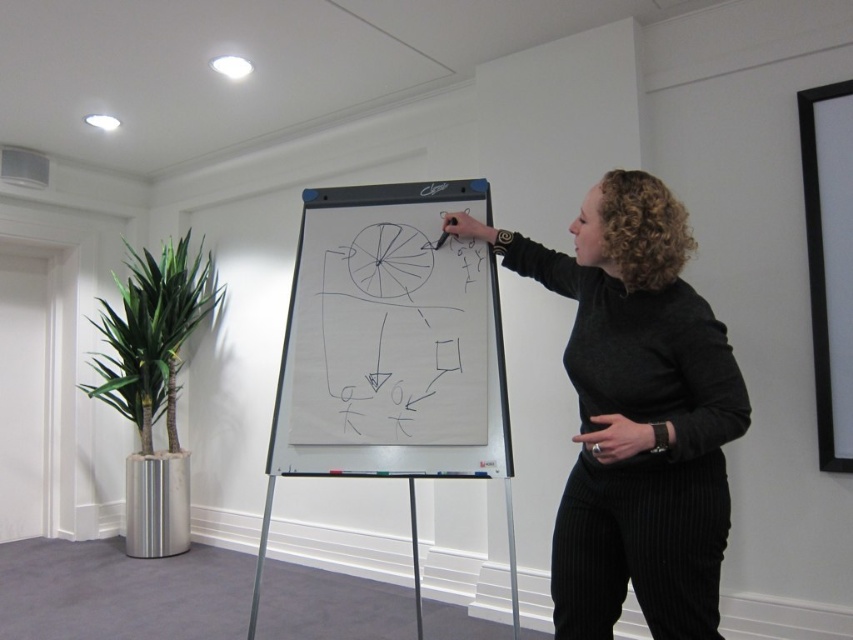
You are standing in front of the whiteboard at center and want to reach for the black matte sweater at center. In which direction should you move to grab it?

The black matte sweater at center is to the right of the whiteboard at center, so you should move to your right to grab it.

You are standing in the room where the flip chart is being used. You need to place a small sticker exactly at the center of the black matte sweater at center. According to the coordinates provided, where should you place the sticker?

The sticker should be placed at the coordinates point [636,413], as that is the 2D location of the black matte sweater at center.

You are an assistant who needs to determine if the black matte sweater at center can be fully visible when standing behind the whiteboard at center. Based on their heights, can the sweater be seen?

The black matte sweater at center has a lesser height compared to whiteboard at center, so the sweater will be partially or fully obscured by the whiteboard when viewed from behind.